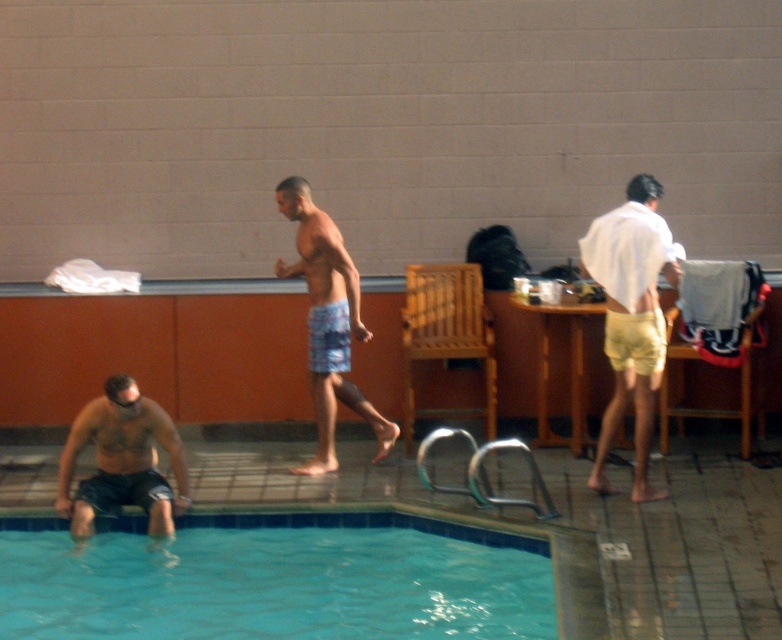
Question: Which point appears closest to the camera in this image?

Choices:
 (A) (655, 356)
 (B) (332, 404)

Answer: (A)

Question: Which point appears closest to the camera in this image?

Choices:
 (A) (170, 531)
 (B) (329, 269)
 (C) (651, 289)
 (D) (485, 618)

Answer: (D)

Question: Is blue glossy water at lower left to the left of matte black shorts at lower left from the viewer's perspective?

Choices:
 (A) no
 (B) yes

Answer: (A)

Question: Is blue glossy water at lower left positioned at the back of matte white shirt at right?

Choices:
 (A) yes
 (B) no

Answer: (B)

Question: Which point is farther to the camera?

Choices:
 (A) matte white shirt at right
 (B) matte black shorts at lower left
 (C) blue printed shorts at center
 (D) blue glossy water at lower left

Answer: (C)

Question: Does matte white shirt at right have a larger size compared to blue printed shorts at center?

Choices:
 (A) yes
 (B) no

Answer: (B)